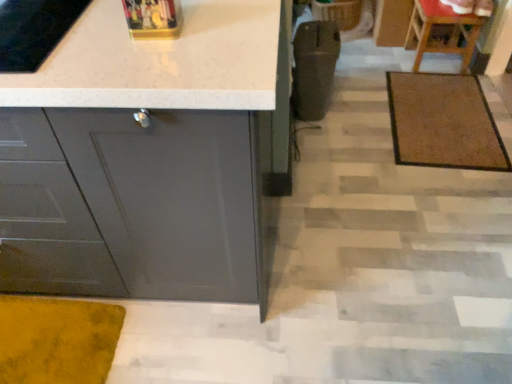
Question: Would you say brown textured mat at center right is a long distance from wooden chair at upper right?

Choices:
 (A) yes
 (B) no

Answer: (B)

Question: From the image's perspective, does brown textured mat at center right appear lower than wooden chair at upper right?

Choices:
 (A) no
 (B) yes

Answer: (B)

Question: Is brown textured mat at center right next to wooden chair at upper right?

Choices:
 (A) yes
 (B) no

Answer: (B)

Question: Does brown textured mat at center right have a larger size compared to wooden chair at upper right?

Choices:
 (A) yes
 (B) no

Answer: (B)

Question: Is brown textured mat at center right shorter than wooden chair at upper right?

Choices:
 (A) no
 (B) yes

Answer: (B)

Question: Can you confirm if brown textured mat at center right is positioned to the right of wooden chair at upper right?

Choices:
 (A) no
 (B) yes

Answer: (A)

Question: Can brown textured mat at center right be found inside matte gray cabinet at lower left?

Choices:
 (A) yes
 (B) no

Answer: (B)

Question: Would you say matte gray cabinet at lower left is outside brown textured mat at center right?

Choices:
 (A) yes
 (B) no

Answer: (A)

Question: Is the depth of matte gray cabinet at lower left greater than that of brown textured mat at center right?

Choices:
 (A) no
 (B) yes

Answer: (A)

Question: Does matte gray cabinet at lower left have a larger size compared to brown textured mat at center right?

Choices:
 (A) no
 (B) yes

Answer: (B)

Question: Considering the relative positions of matte gray cabinet at lower left and brown textured mat at center right in the image provided, is matte gray cabinet at lower left to the right of brown textured mat at center right from the viewer's perspective?

Choices:
 (A) yes
 (B) no

Answer: (B)

Question: Does matte gray cabinet at lower left have a lesser width compared to brown textured mat at center right?

Choices:
 (A) no
 (B) yes

Answer: (B)

Question: Is wooden chair at upper right turned away from brown textured mat at center right?

Choices:
 (A) yes
 (B) no

Answer: (B)